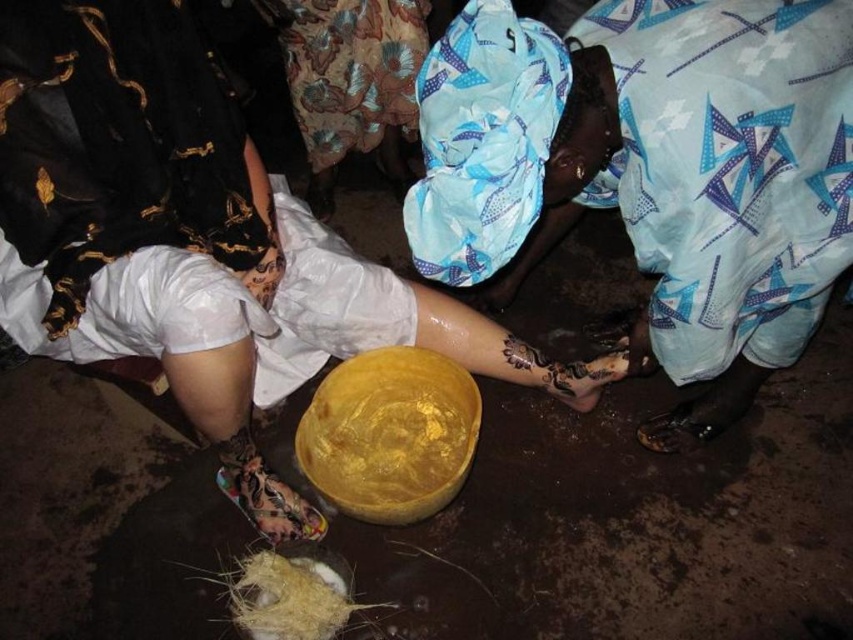
Does blue printed fabric at upper center appear on the left side of straw nest at lower center?

No, blue printed fabric at upper center is not to the left of straw nest at lower center.

Is point (317, 170) farther from camera compared to point (289, 611)?

Yes, point (317, 170) is behind point (289, 611).

Locate an element on the screen. blue printed fabric at upper center is located at coordinates (351, 83).

The height and width of the screenshot is (640, 853). What do you see at coordinates (194, 241) in the screenshot?
I see `yellow matte bowl at center` at bounding box center [194, 241].

Locate an element on the screen. This screenshot has height=640, width=853. yellow matte bowl at center is located at coordinates (194, 241).

In the scene shown: Can you confirm if blue printed fabric at center is shorter than golden matte bowl at center?

In fact, blue printed fabric at center may be taller than golden matte bowl at center.

Which is behind, point (577, 216) or point (434, 481)?

The point (577, 216) is behind.

Locate an element on the screen. The width and height of the screenshot is (853, 640). blue printed fabric at center is located at coordinates (653, 170).